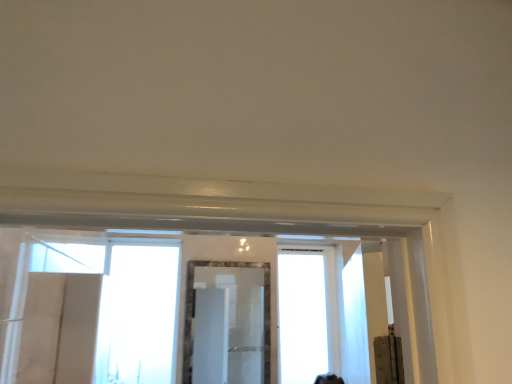
Describe the element at coordinates (138, 315) in the screenshot. I see `transparent glass window at center, positioned as the 2th window in right-to-left order` at that location.

In order to face marble frame mirror at center, should I rotate leftwards or rightwards?

To face it directly, rotate left by 3.599 degrees.

What do you see at coordinates (194, 310) in the screenshot? I see `marble frame mirror at center` at bounding box center [194, 310].

I want to click on transparent glass window at center, which is counted as the 1th window, starting from the left, so click(x=138, y=315).

Considering the positions of point (311, 305) and point (185, 351), is point (311, 305) closer or farther from the camera than point (185, 351)?

Point (311, 305) appears to be farther away from the viewer than point (185, 351).

Is transparent glass window at center, which ranks as the second window in left-to-right order, completely or partially outside of marble frame mirror at center?

Indeed, transparent glass window at center, which ranks as the second window in left-to-right order, is completely outside marble frame mirror at center.

From the image's perspective, is transparent glass window at center, which ranks as the second window in left-to-right order, under marble frame mirror at center?

Correct, transparent glass window at center, which ranks as the second window in left-to-right order, appears lower than marble frame mirror at center in the image.

Does transparent glass window at center, the first window positioned from the right, have a larger size compared to marble frame mirror at center?

Yes.

Does transparent glass window at center, the first window positioned from the right, have a lesser height compared to transparent glass window at center, which is counted as the 1th window, starting from the left?

In fact, transparent glass window at center, the first window positioned from the right, may be taller than transparent glass window at center, which is counted as the 1th window, starting from the left.

Is transparent glass window at center, the first window positioned from the right, at the right side of transparent glass window at center, positioned as the 2th window in right-to-left order?

Yes.

Which object is further away from the camera taking this photo, transparent glass window at center, which ranks as the second window in left-to-right order, or transparent glass window at center, which is counted as the 1th window, starting from the left?

transparent glass window at center, which ranks as the second window in left-to-right order, is further from the camera.

Is transparent glass window at center, positioned as the 2th window in right-to-left order, surrounded by transparent glass window at center, which ranks as the second window in left-to-right order?

No, transparent glass window at center, positioned as the 2th window in right-to-left order, is located outside of transparent glass window at center, which ranks as the second window in left-to-right order.

From the image's perspective, between transparent glass window at center, positioned as the 2th window in right-to-left order, and transparent glass window at center, the first window positioned from the right, who is located below?

From the image's view, transparent glass window at center, the first window positioned from the right, is below.

How distant is transparent glass window at center, which is counted as the 1th window, starting from the left, from transparent glass window at center, the first window positioned from the right?

transparent glass window at center, which is counted as the 1th window, starting from the left, and transparent glass window at center, the first window positioned from the right, are 1.03 meters apart from each other.

Is transparent glass window at center, which is counted as the 1th window, starting from the left, beside transparent glass window at center, which ranks as the second window in left-to-right order?

No, transparent glass window at center, which is counted as the 1th window, starting from the left, is not beside transparent glass window at center, which ranks as the second window in left-to-right order.

Do you think transparent glass window at center, which is counted as the 1th window, starting from the left, is within transparent glass window at center, which ranks as the second window in left-to-right order, or outside of it?

The correct answer is: outside.

Considering the positions of point (264, 358) and point (150, 354), is point (264, 358) closer or farther from the camera than point (150, 354)?

Point (264, 358).

From the image's perspective, is marble frame mirror at center over transparent glass window at center, which is counted as the 1th window, starting from the left?

Incorrect, from the image's perspective, marble frame mirror at center is lower than transparent glass window at center, which is counted as the 1th window, starting from the left.

Is marble frame mirror at center not close to transparent glass window at center, which is counted as the 1th window, starting from the left?

marble frame mirror at center is near transparent glass window at center, which is counted as the 1th window, starting from the left, not far away.

Does marble frame mirror at center have a smaller size compared to transparent glass window at center, positioned as the 2th window in right-to-left order?

Indeed, marble frame mirror at center has a smaller size compared to transparent glass window at center, positioned as the 2th window in right-to-left order.

From the image's perspective, would you say marble frame mirror at center is shown under transparent glass window at center, which ranks as the second window in left-to-right order?

No, from the image's perspective, marble frame mirror at center is not below transparent glass window at center, which ranks as the second window in left-to-right order.

Is marble frame mirror at center not near transparent glass window at center, the first window positioned from the right?

No.

Is marble frame mirror at center in front of or behind transparent glass window at center, the first window positioned from the right, in the image?

marble frame mirror at center is in front of transparent glass window at center, the first window positioned from the right.

Is transparent glass window at center, positioned as the 2th window in right-to-left order, bigger than marble frame mirror at center?

Indeed, transparent glass window at center, positioned as the 2th window in right-to-left order, has a larger size compared to marble frame mirror at center.

Is point (113, 327) closer to camera compared to point (189, 292)?

Yes.

Would you say transparent glass window at center, positioned as the 2th window in right-to-left order, is to the left or to the right of marble frame mirror at center in the picture?

From the image, it's evident that transparent glass window at center, positioned as the 2th window in right-to-left order, is to the left of marble frame mirror at center.

Which of these two, transparent glass window at center, positioned as the 2th window in right-to-left order, or marble frame mirror at center, stands shorter?

marble frame mirror at center.

Find the location of a particular element. This screenshot has height=384, width=512. the 2nd window behind the marble frame mirror at center, starting your count from the anchor is located at coordinates (306, 314).

The width and height of the screenshot is (512, 384). I want to click on window to the left of transparent glass window at center, which ranks as the second window in left-to-right order, so click(x=138, y=315).

When comparing their distances from transparent glass window at center, positioned as the 2th window in right-to-left order, does marble frame mirror at center or transparent glass window at center, which ranks as the second window in left-to-right order, seem further?

Among the two, transparent glass window at center, which ranks as the second window in left-to-right order, is located further to transparent glass window at center, positioned as the 2th window in right-to-left order.

When comparing their distances from marble frame mirror at center, does transparent glass window at center, which is counted as the 1th window, starting from the left, or transparent glass window at center, which ranks as the second window in left-to-right order, seem closer?

The object closer to marble frame mirror at center is transparent glass window at center, which is counted as the 1th window, starting from the left.

Looking at the image, which one is located closer to transparent glass window at center, positioned as the 2th window in right-to-left order, transparent glass window at center, the first window positioned from the right, or marble frame mirror at center?

marble frame mirror at center is closer to transparent glass window at center, positioned as the 2th window in right-to-left order.

In the scene shown: Considering their positions, is transparent glass window at center, the first window positioned from the right, positioned closer to marble frame mirror at center than transparent glass window at center, which is counted as the 1th window, starting from the left?

transparent glass window at center, which is counted as the 1th window, starting from the left, lies closer to marble frame mirror at center than the other object.

When comparing their distances from transparent glass window at center, which ranks as the second window in left-to-right order, does marble frame mirror at center or transparent glass window at center, positioned as the 2th window in right-to-left order, seem closer?

Based on the image, marble frame mirror at center appears to be nearer to transparent glass window at center, which ranks as the second window in left-to-right order.

Which object lies further to the anchor point transparent glass window at center, which ranks as the second window in left-to-right order, transparent glass window at center, which is counted as the 1th window, starting from the left, or marble frame mirror at center?

transparent glass window at center, which is counted as the 1th window, starting from the left, lies further to transparent glass window at center, which ranks as the second window in left-to-right order, than the other object.

Image resolution: width=512 pixels, height=384 pixels. In order to click on mirror between transparent glass window at center, which is counted as the 1th window, starting from the left, and transparent glass window at center, the first window positioned from the right, in the horizontal direction in this screenshot , I will do `click(194, 310)`.